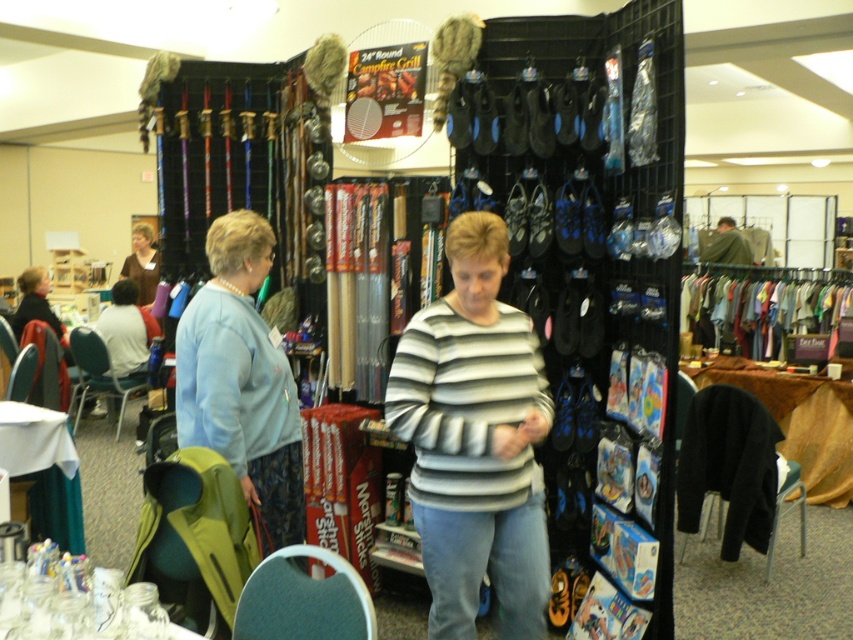
You are a photographer at the exhibition and need to capture both the striped cotton sweater at center and the light blue sweater at center in a single frame. Which sweater should you position to the left to ensure both are visible?

The striped cotton sweater at center is on the right side of the light blue sweater at center, so to include both in the frame, position the light blue sweater at center to the left.

You are a photographer setting up for an event. You need to decide which clothing item to focus on based on their sizes. Which one is bigger between the striped cotton sweater at center and the green fabric jacket at center?

The striped cotton sweater at center is larger in size than the green fabric jacket at center, so you should focus on the striped cotton sweater at center.

In the scene shown: You are a photographer at the exhibition and want to capture the striped cotton sweater at center. Where should you position your camera to ensure it is in the frame?

To capture the striped cotton sweater at center, position your camera so that it is aimed at the coordinates point (474, 440) where the striped cotton sweater at center is located.